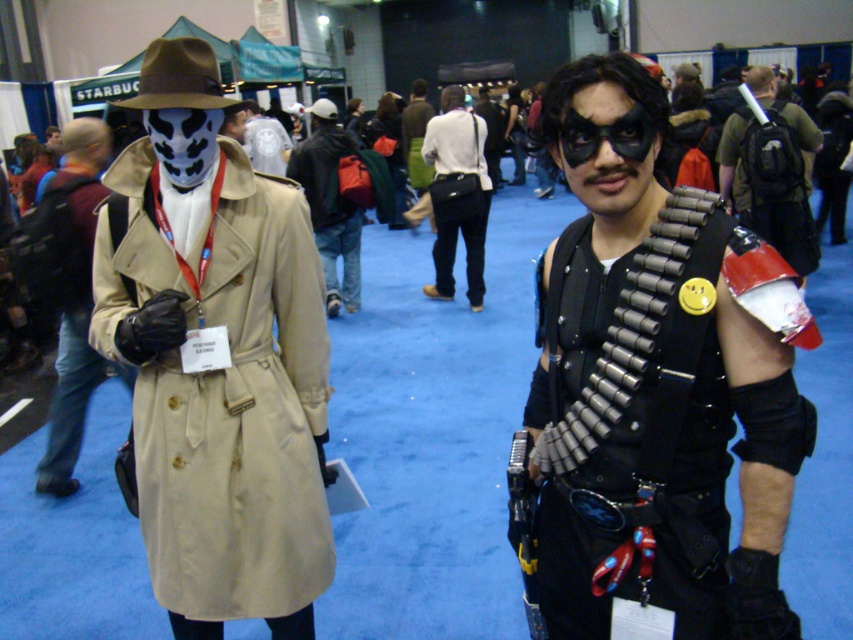
Question: Does beige fabric trench coat at left have a greater width compared to white cotton shirt at center?

Choices:
 (A) no
 (B) yes

Answer: (B)

Question: Which of these objects is positioned closest to the white cotton shirt at center?

Choices:
 (A) metallic bullet belt at center
 (B) white matte mask at center

Answer: (B)

Question: Is matte black trench coat at center below white matte mask at center?

Choices:
 (A) yes
 (B) no

Answer: (A)

Question: Which of the following is the farthest from the observer?

Choices:
 (A) (810, 240)
 (B) (308, 166)

Answer: (B)

Question: Is metallic bullet belt at center to the right of white matte mask at center from the viewer's perspective?

Choices:
 (A) no
 (B) yes

Answer: (B)

Question: Among these objects, which one is nearest to the camera?

Choices:
 (A) matte black trench coat at center
 (B) matte black mask at center

Answer: (B)